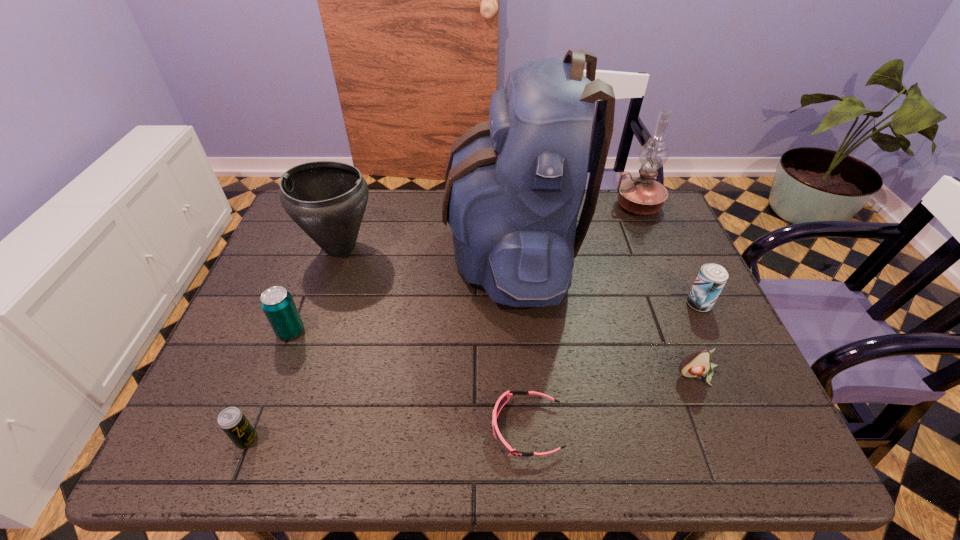
The image size is (960, 540). Find the location of `backpack situated at the far edge`. backpack situated at the far edge is located at coordinates (514, 185).

The width and height of the screenshot is (960, 540). I want to click on oil lamp that is at the far edge, so click(641, 195).

Find the location of a particular element. The height and width of the screenshot is (540, 960). urn present at the far edge is located at coordinates (327, 199).

Where is `beer can located in the near edge section of the desktop`? beer can located in the near edge section of the desktop is located at coordinates click(x=232, y=421).

This screenshot has width=960, height=540. I want to click on goggles situated at the near edge, so click(x=504, y=398).

The image size is (960, 540). Identify the location of urn that is at the left edge. (327, 199).

Find the location of `oil lamp situated at the right edge`. oil lamp situated at the right edge is located at coordinates (641, 195).

Locate an element on the screen. The height and width of the screenshot is (540, 960). beer can present at the right edge is located at coordinates (711, 279).

Where is `avocado that is at the right edge`? The image size is (960, 540). avocado that is at the right edge is located at coordinates (696, 364).

Image resolution: width=960 pixels, height=540 pixels. Find the location of `object present at the far left corner`. object present at the far left corner is located at coordinates (327, 199).